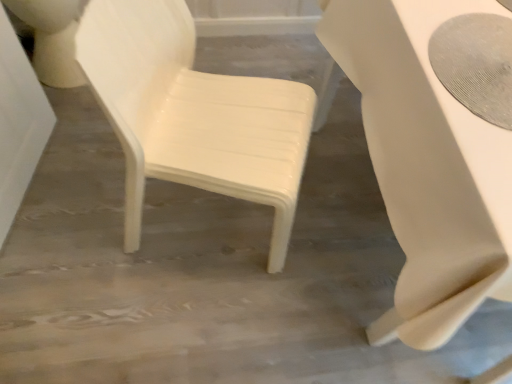
Question: Is white glossy table at right looking in the opposite direction of white glossy chair at center?

Choices:
 (A) no
 (B) yes

Answer: (A)

Question: Is white glossy table at right positioned behind white glossy chair at center?

Choices:
 (A) yes
 (B) no

Answer: (B)

Question: Does white glossy table at right have a greater height compared to white glossy chair at center?

Choices:
 (A) yes
 (B) no

Answer: (B)

Question: From the image's perspective, is white glossy table at right above white glossy chair at center?

Choices:
 (A) yes
 (B) no

Answer: (B)

Question: Considering the relative sizes of white glossy table at right and white glossy chair at center in the image provided, is white glossy table at right wider than white glossy chair at center?

Choices:
 (A) no
 (B) yes

Answer: (B)

Question: Is point (415, 218) closer or farther from the camera than point (302, 99)?

Choices:
 (A) closer
 (B) farther

Answer: (A)

Question: Visually, is white glossy table at right positioned to the left or to the right of white glossy chair at center?

Choices:
 (A) right
 (B) left

Answer: (A)

Question: From the image's perspective, is white glossy table at right above or below white glossy chair at center?

Choices:
 (A) above
 (B) below

Answer: (B)

Question: Do you think white glossy table at right is within white glossy chair at center, or outside of it?

Choices:
 (A) inside
 (B) outside

Answer: (B)

Question: Is white glossy table at right to the left or to the right of white glossy toilet bowl at upper left in the image?

Choices:
 (A) right
 (B) left

Answer: (A)

Question: Is white glossy table at right taller or shorter than white glossy toilet bowl at upper left?

Choices:
 (A) short
 (B) tall

Answer: (B)

Question: Is white glossy table at right inside or outside of white glossy toilet bowl at upper left?

Choices:
 (A) inside
 (B) outside

Answer: (B)

Question: Considering the positions of white glossy table at right and white glossy toilet bowl at upper left in the image, is white glossy table at right wider or thinner than white glossy toilet bowl at upper left?

Choices:
 (A) wide
 (B) thin

Answer: (A)

Question: From a real-world perspective, relative to white glossy table at right, is white glossy toilet bowl at upper left vertically above or below?

Choices:
 (A) below
 (B) above

Answer: (A)

Question: From the image's perspective, is white glossy toilet bowl at upper left above or below white glossy table at right?

Choices:
 (A) above
 (B) below

Answer: (A)